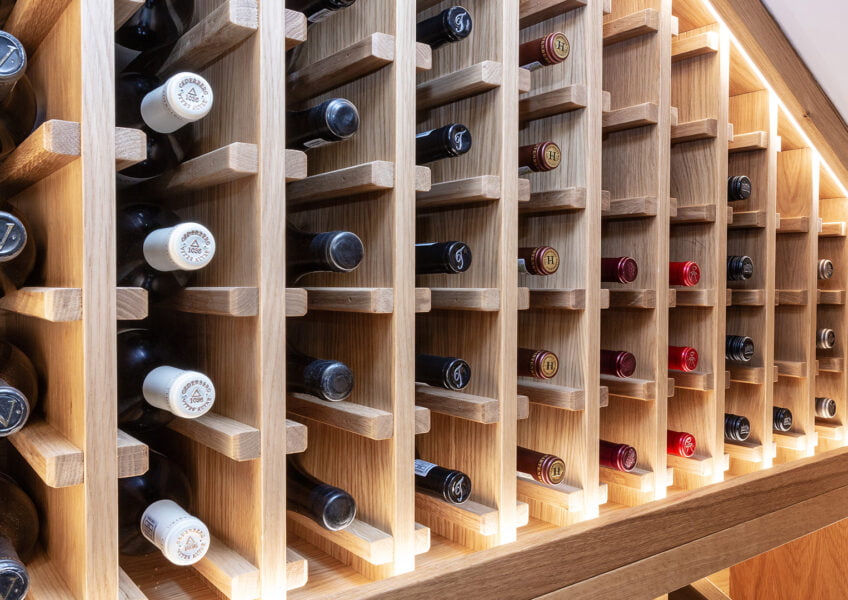
I want to click on empty wine bottle spots, so click(634, 157), click(634, 91), click(696, 84), click(699, 169), click(738, 115), click(793, 169), click(823, 208), click(795, 252), click(789, 336).